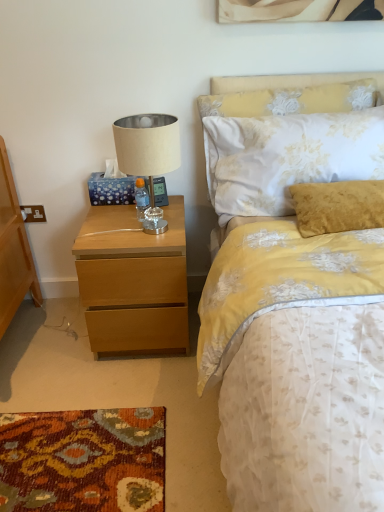
What are the coordinates of `vacant space positioned to the left of light wood nightstand at left` in the screenshot? It's located at (46, 341).